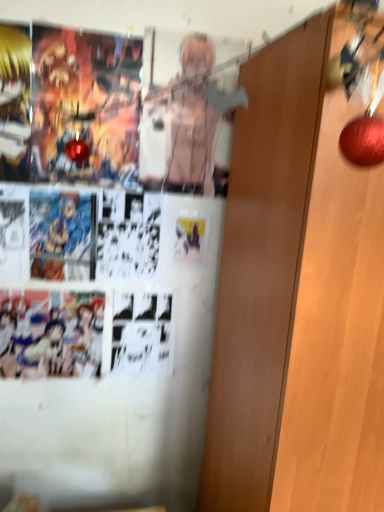
Question: Can you see wooden door at right touching golden hair anime character at left?

Choices:
 (A) yes
 (B) no

Answer: (B)

Question: From the image's perspective, is wooden door at right located beneath golden hair anime character at left?

Choices:
 (A) no
 (B) yes

Answer: (B)

Question: From a real-world perspective, is wooden door at right located higher than golden hair anime character at left?

Choices:
 (A) no
 (B) yes

Answer: (A)

Question: Is golden hair anime character at left surrounded by wooden door at right?

Choices:
 (A) no
 (B) yes

Answer: (A)

Question: Is wooden door at right to the left of golden hair anime character at left from the viewer's perspective?

Choices:
 (A) yes
 (B) no

Answer: (B)

Question: Does wooden door at right lie in front of golden hair anime character at left?

Choices:
 (A) no
 (B) yes

Answer: (B)

Question: Does golden hair anime character at left have a larger size compared to wooden door at right?

Choices:
 (A) no
 (B) yes

Answer: (A)

Question: Are golden hair anime character at left and wooden door at right beside each other?

Choices:
 (A) no
 (B) yes

Answer: (A)

Question: From a real-world perspective, is golden hair anime character at left positioned under wooden door at right based on gravity?

Choices:
 (A) no
 (B) yes

Answer: (A)

Question: Does golden hair anime character at left have a greater height compared to wooden door at right?

Choices:
 (A) yes
 (B) no

Answer: (B)

Question: Considering the relative sizes of golden hair anime character at left and wooden door at right in the image provided, is golden hair anime character at left smaller than wooden door at right?

Choices:
 (A) yes
 (B) no

Answer: (A)

Question: Would you say wooden door at right is part of golden hair anime character at left's contents?

Choices:
 (A) yes
 (B) no

Answer: (B)

Question: In terms of width, does golden hair anime character at left look wider or thinner when compared to wooden door at right?

Choices:
 (A) wide
 (B) thin

Answer: (B)